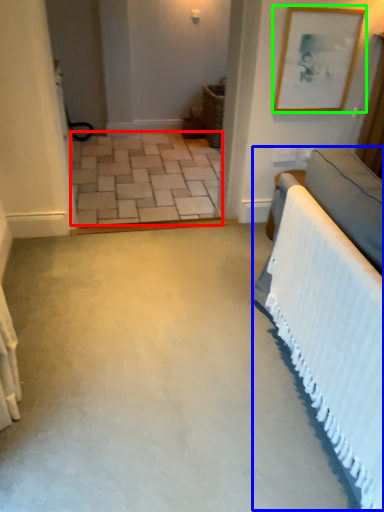
Question: Based on their relative distances, which object is farther from concrete (highlighted by a red box)? Choose from bed (highlighted by a blue box) and picture frame (highlighted by a green box).

Choices:
 (A) bed
 (B) picture frame

Answer: (A)